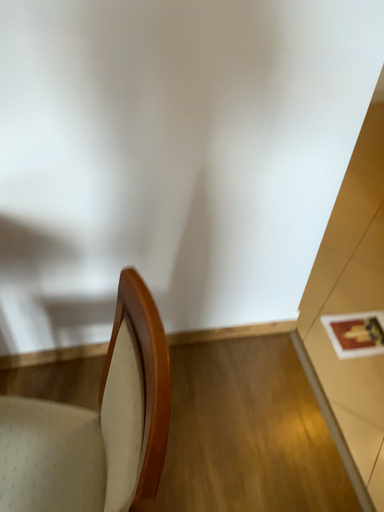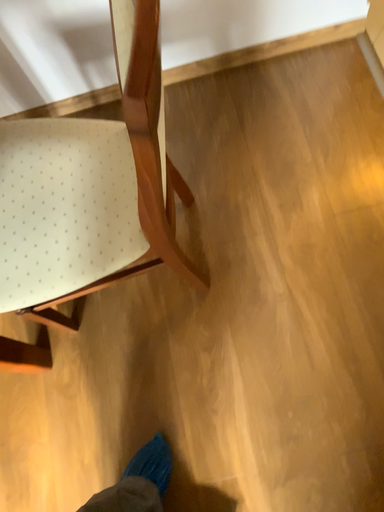
Question: How did the camera likely rotate when shooting the video?

Choices:
 (A) rotated upward
 (B) rotated downward

Answer: (B)